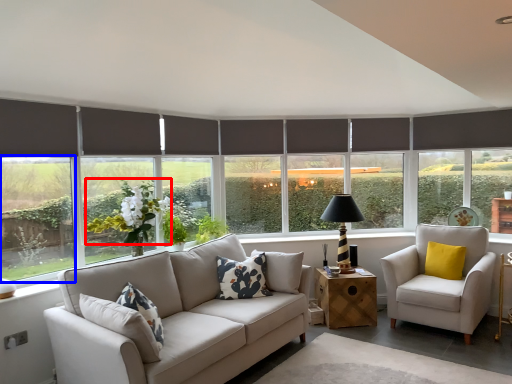
Question: Which point is closer to the camera, flower (highlighted by a red box) or window screen (highlighted by a blue box)?

Choices:
 (A) flower
 (B) window screen

Answer: (B)